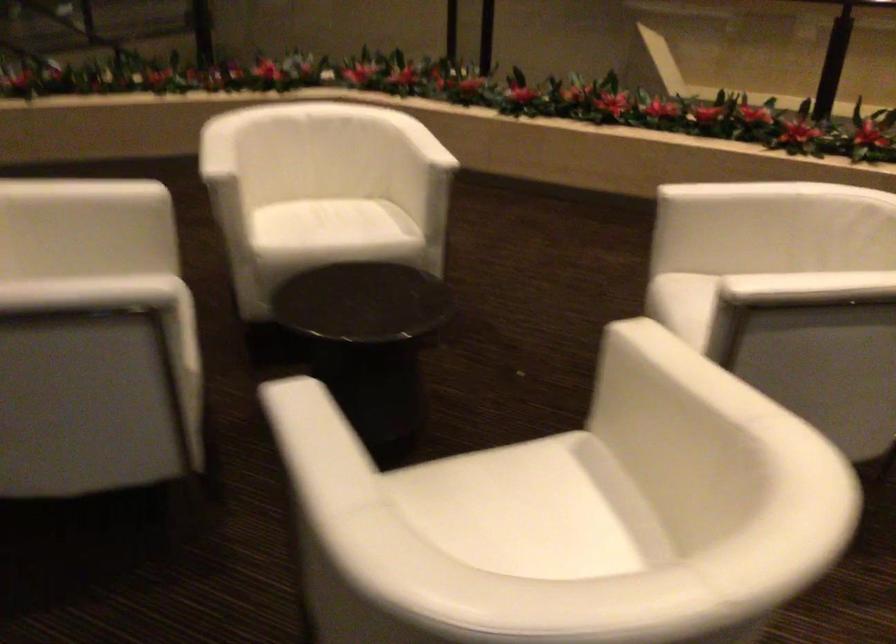
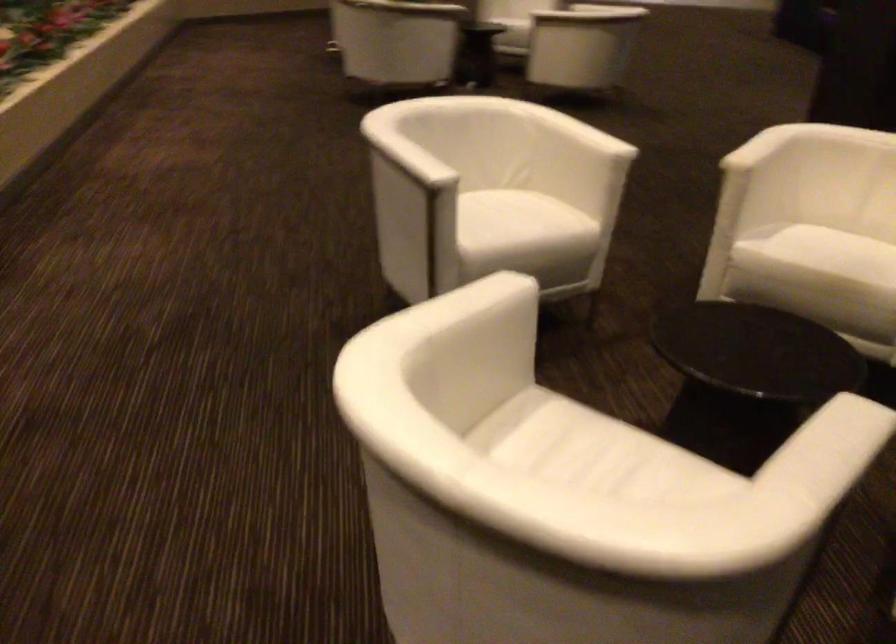
In the second image, find the point that corresponds to (x=334, y=225) in the first image.

(616, 462)